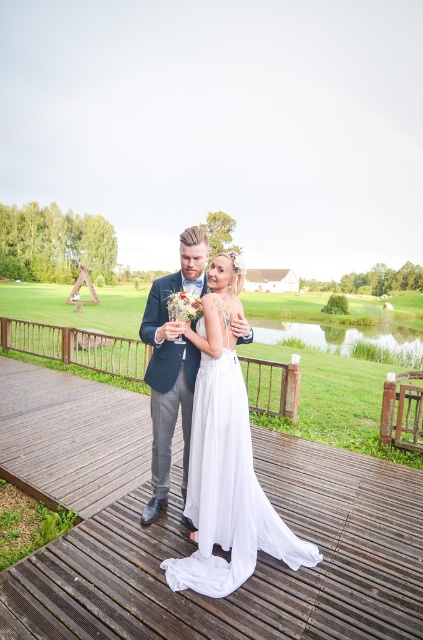
Who is shorter, wooden deck at center or white satin dress at center?

Standing shorter between the two is wooden deck at center.

Can you confirm if wooden deck at center is positioned to the right of white satin dress at center?

Correct, you'll find wooden deck at center to the right of white satin dress at center.

This screenshot has height=640, width=423. Describe the element at coordinates (186, 531) in the screenshot. I see `wooden deck at center` at that location.

Where is `wooden deck at center`? wooden deck at center is located at coordinates (186, 531).

Which is more to the left, wooden deck at center or matte blue suit at center?

matte blue suit at center

Is wooden deck at center taller than matte blue suit at center?

No.

What do you see at coordinates (186, 531) in the screenshot?
I see `wooden deck at center` at bounding box center [186, 531].

Image resolution: width=423 pixels, height=640 pixels. Find the location of `wooden deck at center`. wooden deck at center is located at coordinates (186, 531).

Is point (241, 513) farther from viewer compared to point (178, 349)?

No, it is not.

Is point (261, 545) behind point (161, 460)?

No, (261, 545) is closer to viewer.

Where is `white satin dress at center`? The image size is (423, 640). white satin dress at center is located at coordinates (227, 476).